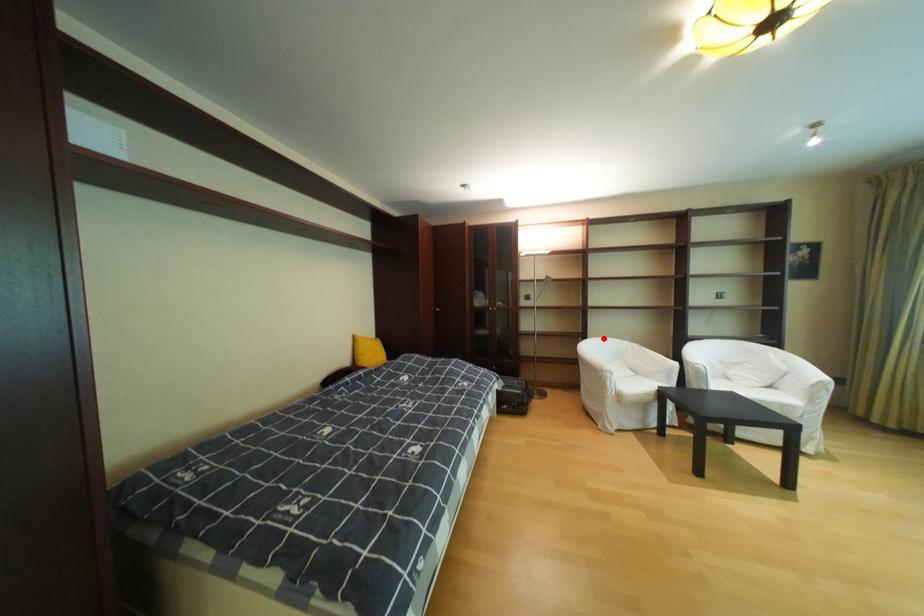
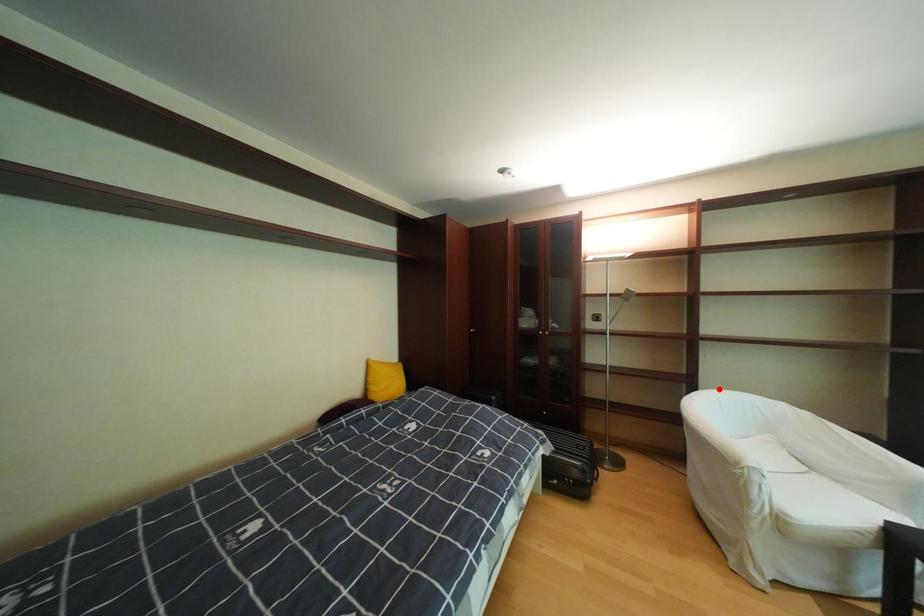
I am providing you with two images of the same scene from different viewpoints. A red point is marked on the first image and another point is marked on the second image. Do the highlighted points in image1 and image2 indicate the same real-world spot?

Yes